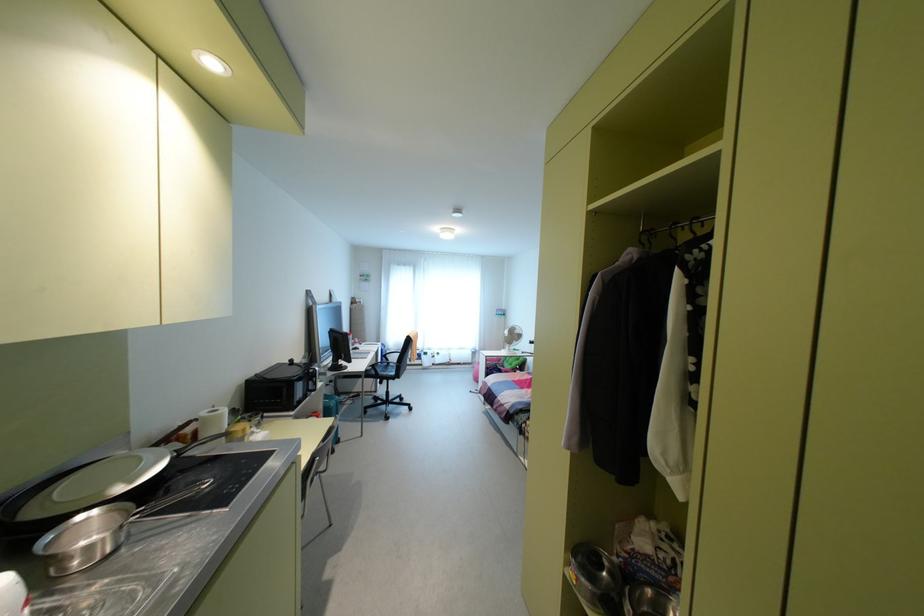
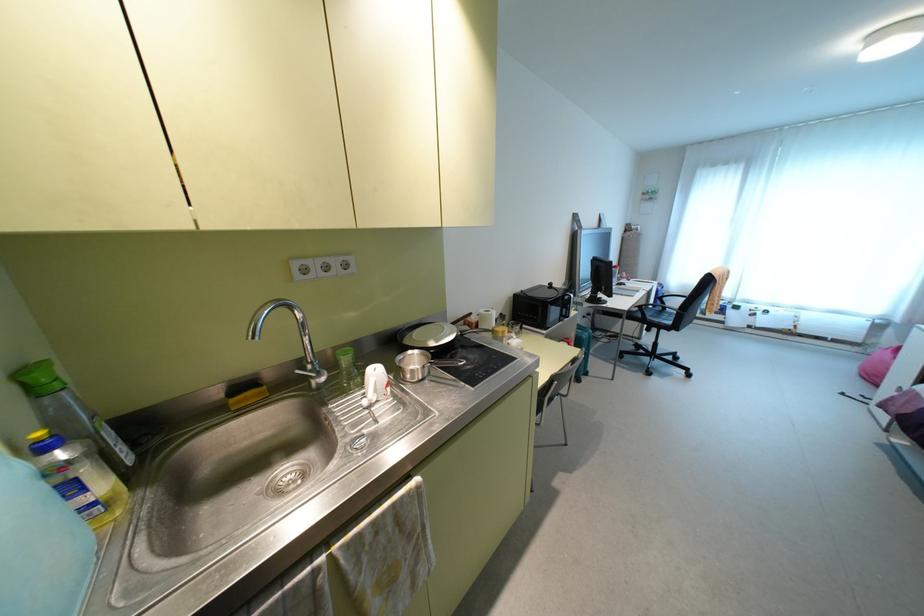
Question: The camera is either moving clockwise (left) or counter-clockwise (right) around the object. The first image is from the beginning of the video and the second image is from the end. Is the camera moving left or right when shooting the video?

Choices:
 (A) Left
 (B) Right

Answer: (B)